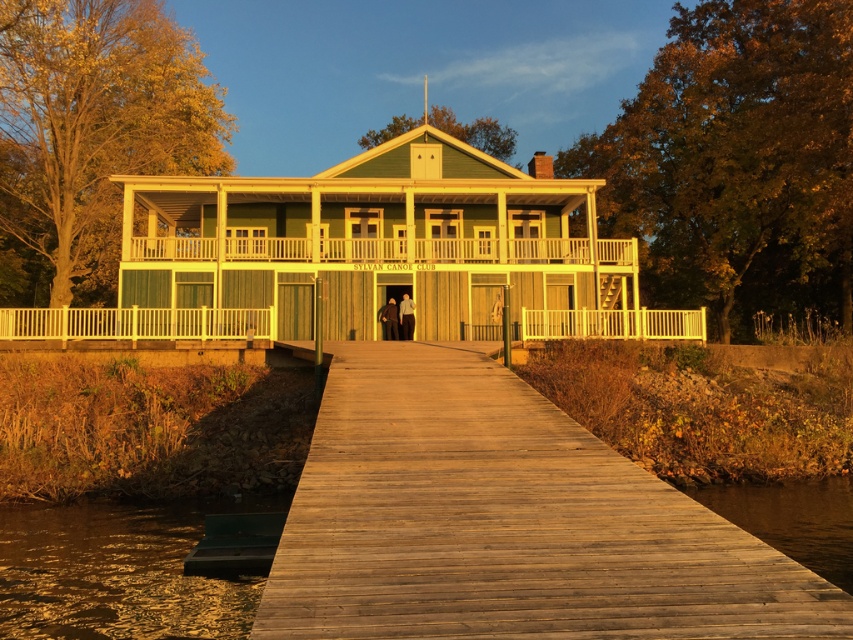
Which is behind, point (15, 627) or point (840, 579)?

The point (840, 579) is behind.

Who is higher up, green wood water at lower left or dark brown wood at lower right?

dark brown wood at lower right is higher up.

This screenshot has width=853, height=640. What do you see at coordinates (119, 572) in the screenshot? I see `green wood water at lower left` at bounding box center [119, 572].

You are a GUI agent. You are given a task and a screenshot of the screen. Output one action in this format:
    pyautogui.click(x=<x>, y=<y>)
    Task: Click on the green wood water at lower left
    
    Given the screenshot: What is the action you would take?
    pyautogui.click(x=119, y=572)

Does wooden porch at center have a larger size compared to white wooden railing at left?

Indeed, wooden porch at center has a larger size compared to white wooden railing at left.

Can you confirm if wooden porch at center is positioned below white wooden railing at left?

Incorrect, wooden porch at center is not positioned below white wooden railing at left.

Is point (624, 248) less distant than point (204, 320)?

No, (624, 248) is further to viewer.

Locate an element on the screen. Image resolution: width=853 pixels, height=640 pixels. wooden porch at center is located at coordinates (415, 250).

Can you confirm if wooden dock at center is bigger than green wood water at lower left?

Yes.

Can you confirm if wooden dock at center is positioned to the right of green wood water at lower left?

Yes, wooden dock at center is to the right of green wood water at lower left.

Is point (381, 451) less distant than point (25, 584)?

Yes, it is in front of point (25, 584).

This screenshot has width=853, height=640. In order to click on wooden dock at center in this screenshot , I will do `click(505, 522)`.